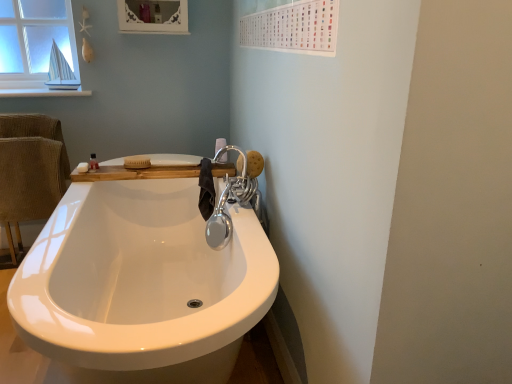
Question: Is shiny metallic faucet at upper right not close to white matte soap at upper left?

Choices:
 (A) yes
 (B) no

Answer: (B)

Question: Is shiny metallic faucet at upper right turned away from white matte soap at upper left?

Choices:
 (A) yes
 (B) no

Answer: (B)

Question: From the image's perspective, is shiny metallic faucet at upper right located above white matte soap at upper left?

Choices:
 (A) no
 (B) yes

Answer: (A)

Question: Does shiny metallic faucet at upper right appear on the right side of white matte soap at upper left?

Choices:
 (A) yes
 (B) no

Answer: (A)

Question: Is shiny metallic faucet at upper right directly adjacent to white matte soap at upper left?

Choices:
 (A) no
 (B) yes

Answer: (A)

Question: Is white glossy toilet paper at upper center bigger or smaller than shiny metallic faucet at upper right?

Choices:
 (A) big
 (B) small

Answer: (B)

Question: From a real-world perspective, relative to shiny metallic faucet at upper right, is white glossy toilet paper at upper center vertically above or below?

Choices:
 (A) above
 (B) below

Answer: (A)

Question: In terms of width, does white glossy toilet paper at upper center look wider or thinner when compared to shiny metallic faucet at upper right?

Choices:
 (A) thin
 (B) wide

Answer: (A)

Question: From the image's perspective, is white glossy toilet paper at upper center positioned above or below shiny metallic faucet at upper right?

Choices:
 (A) below
 (B) above

Answer: (B)

Question: Considering their positions, is beige corduroy armchair at left located in front of or behind shiny metallic faucet at upper right?

Choices:
 (A) front
 (B) behind

Answer: (B)

Question: In terms of height, does beige corduroy armchair at left look taller or shorter compared to shiny metallic faucet at upper right?

Choices:
 (A) short
 (B) tall

Answer: (B)

Question: Choose the correct answer: Is beige corduroy armchair at left inside shiny metallic faucet at upper right or outside it?

Choices:
 (A) outside
 (B) inside

Answer: (A)

Question: Is point (48, 203) positioned closer to the camera than point (209, 231)?

Choices:
 (A) closer
 (B) farther

Answer: (B)

Question: From the image's perspective, is shiny metallic faucet at upper right above or below woodenmaterial/texturecounter top at upper center?

Choices:
 (A) below
 (B) above

Answer: (A)

Question: Considering the positions of shiny metallic faucet at upper right and woodenmaterial/texturecounter top at upper center in the image, is shiny metallic faucet at upper right taller or shorter than woodenmaterial/texturecounter top at upper center?

Choices:
 (A) short
 (B) tall

Answer: (B)